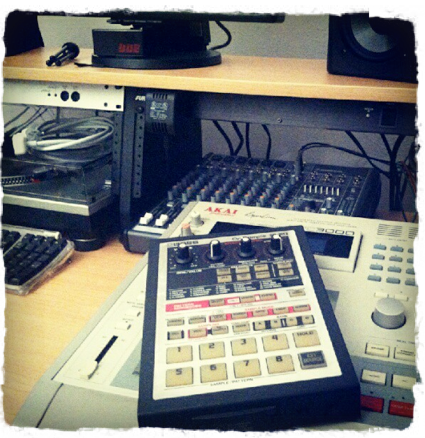
I want to click on bottom of speaker, so click(x=354, y=63).